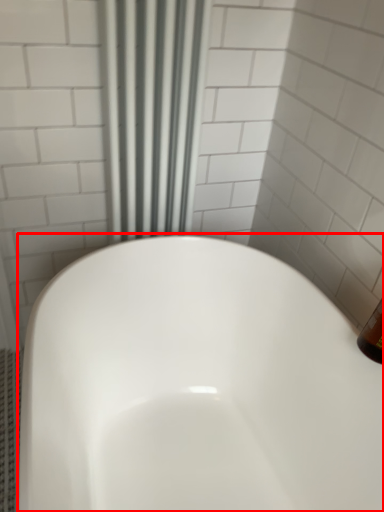
Question: In this image, where is bathtub (annotated by the red box) located relative to shower curtain?

Choices:
 (A) left
 (B) right

Answer: (B)